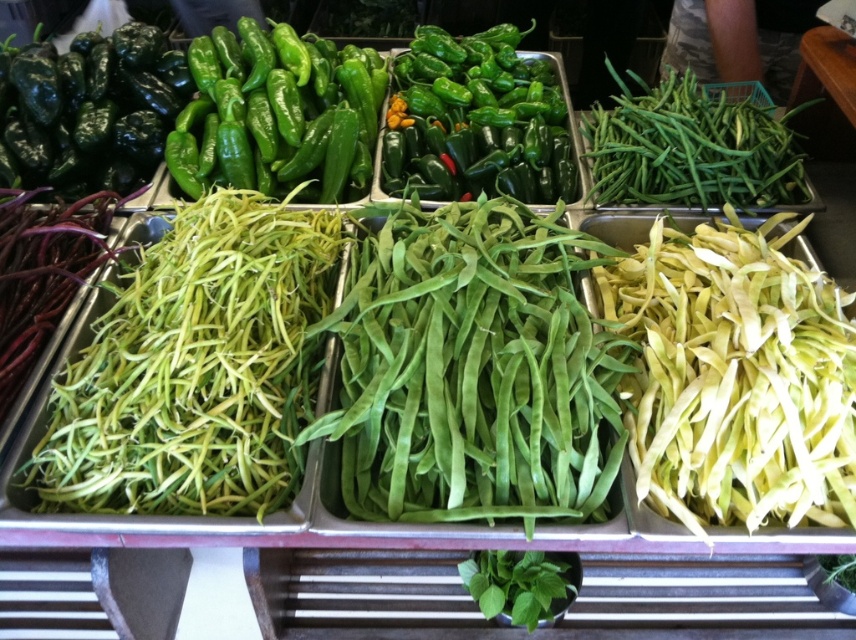
Consider the image. Is the position of glossy dark green pepper at upper left more distant than that of green matte string beans at upper right?

Yes, glossy dark green pepper at upper left is behind green matte string beans at upper right.

Consider the image. Who is shorter, glossy dark green pepper at upper left or green matte string beans at upper right?

green matte string beans at upper right

Who is more distant from viewer, (111, 84) or (705, 118)?

Point (111, 84)

I want to click on glossy dark green pepper at upper left, so click(88, 109).

Based on the photo, does green matte string beans at upper right appear on the right side of green leafy at bottom?

Indeed, green matte string beans at upper right is positioned on the right side of green leafy at bottom.

Does green matte string beans at upper right come in front of green leafy at bottom?

No, it is not.

Locate an element on the screen. Image resolution: width=856 pixels, height=640 pixels. green matte string beans at upper right is located at coordinates (693, 147).

This screenshot has width=856, height=640. Find the location of `green glossy peppers at upper center`. green glossy peppers at upper center is located at coordinates (277, 113).

Between green glossy peppers at upper center and green glossy peppers at center, which one has more height?

Standing taller between the two is green glossy peppers at center.

Is point (199, 145) in front of point (528, 81)?

That is True.

Where is `green glossy peppers at upper center`? The image size is (856, 640). green glossy peppers at upper center is located at coordinates (277, 113).